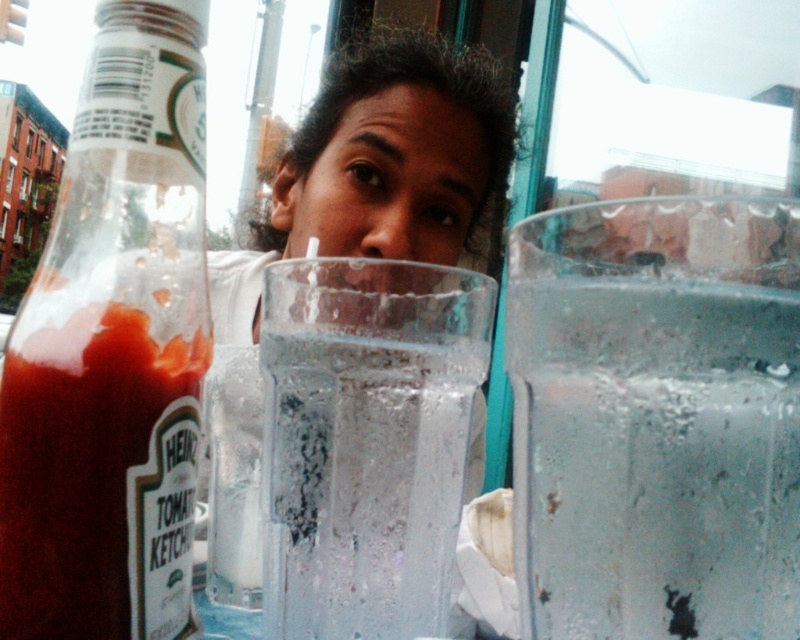
Question: Does clear glass ice at right appear under translucent glass bottle at left?

Choices:
 (A) yes
 (B) no

Answer: (A)

Question: Which of the following is the closest to the observer?

Choices:
 (A) clear glass water at center
 (B) translucent glass bottle at left
 (C) clear glass ice at right

Answer: (C)

Question: Can you confirm if translucent glass bottle at left is thinner than clear glass water at center?

Choices:
 (A) no
 (B) yes

Answer: (B)

Question: Can you confirm if translucent glass bottle at left is positioned to the right of clear glass water at center?

Choices:
 (A) yes
 (B) no

Answer: (B)

Question: Which of the following is the farthest from the observer?

Choices:
 (A) [542, 624]
 (B) [417, 493]

Answer: (B)

Question: Among these objects, which one is farthest from the camera?

Choices:
 (A) clear glass ice at right
 (B) clear glass water at center
 (C) translucent glass bottle at left

Answer: (B)